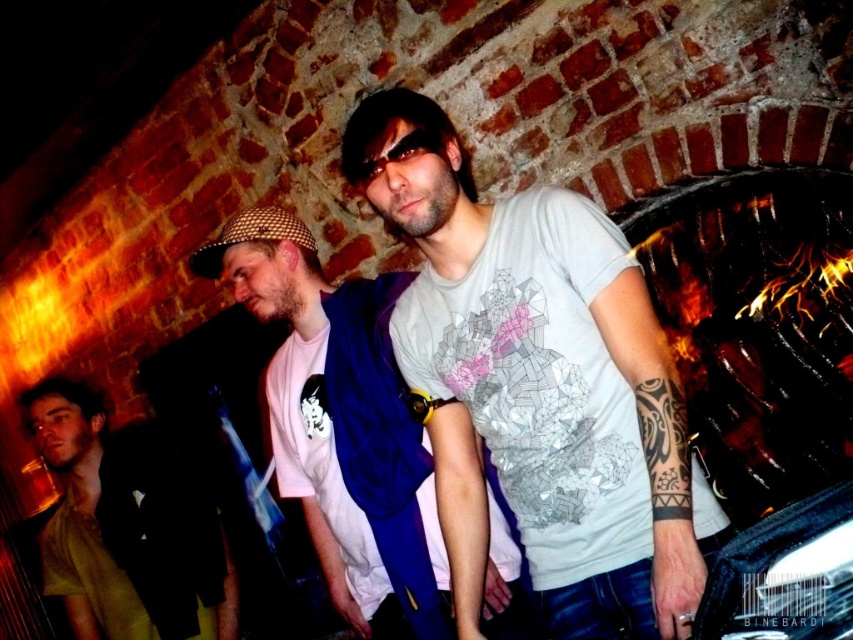
Can you confirm if white matte t-shirt at center is positioned to the left of green matte shirt at lower left?

In fact, white matte t-shirt at center is to the right of green matte shirt at lower left.

Does white matte t-shirt at center have a smaller size compared to green matte shirt at lower left?

Indeed, white matte t-shirt at center has a smaller size compared to green matte shirt at lower left.

What are the coordinates of `white matte t-shirt at center` in the screenshot? It's located at (538, 385).

Is white printed t-shirt at center shorter than green matte shirt at lower left?

Incorrect, white printed t-shirt at center's height does not fall short of green matte shirt at lower left's.

I want to click on white printed t-shirt at center, so click(x=341, y=426).

Can you confirm if white matte t-shirt at center is wider than white printed t-shirt at center?

No.

Can you confirm if white matte t-shirt at center is positioned below white printed t-shirt at center?

Actually, white matte t-shirt at center is above white printed t-shirt at center.

Between point (610, 225) and point (332, 365), which one is positioned behind?

Positioned behind is point (332, 365).

The height and width of the screenshot is (640, 853). I want to click on white matte t-shirt at center, so click(538, 385).